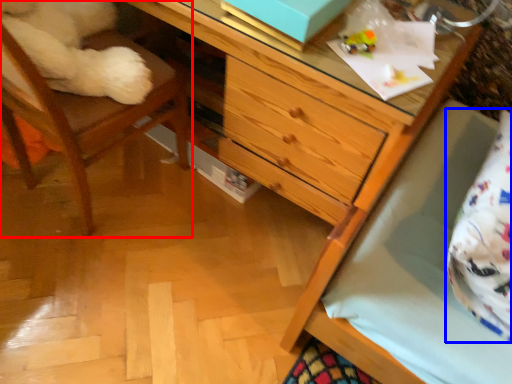
Question: Which object appears closest to the camera in this image, chair (highlighted by a red box) or pillow (highlighted by a blue box)?

Choices:
 (A) chair
 (B) pillow

Answer: (A)